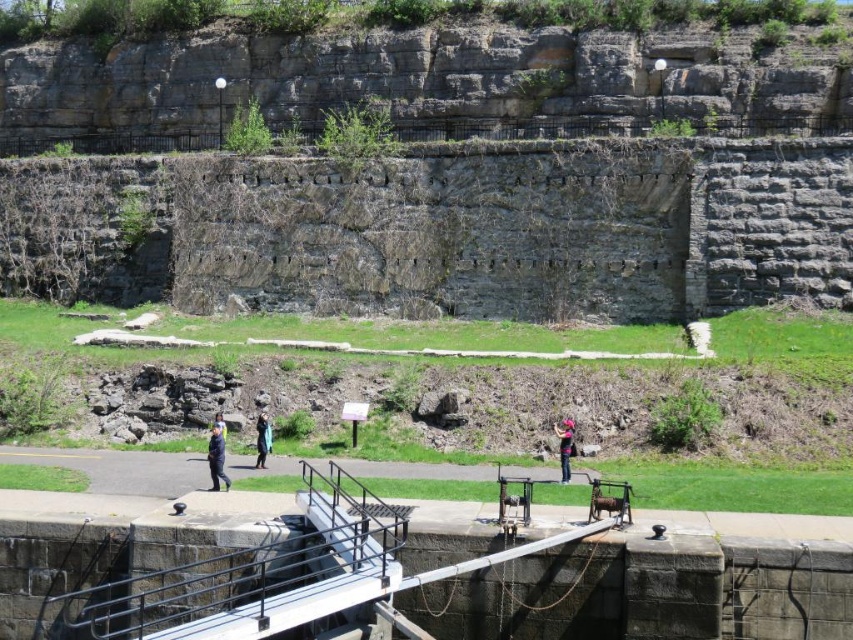
Based on the photo, you are a photographer standing at the top of the lock gate. You want to capture a photo of both the blue fabric jacket at lower left and the blue denim jacket at center in the same frame. Given that your camera has a 50mm lens, which has a field of view that can capture objects up to 3 meters apart, will you be able to include both jackets in your photo?

The blue fabric jacket at lower left is 2.63 meters away from the blue denim jacket at center. Since the distance between them is less than 3 meters, your camera with a 50mm lens can capture both jackets in the same frame.

You are a photographer standing at the top of the canal lock gate. You see the pink fabric at lower center and the blue denim jacket at center. If you want to capture both in a single photo without moving, will they both fit in your camera frame that has a 10 meter width capacity?

The pink fabric at lower center and blue denim jacket at center are 7.77 meters apart. Since the distance between them is less than the camera frame width of 10 meters, both can be captured in a single photo without moving.